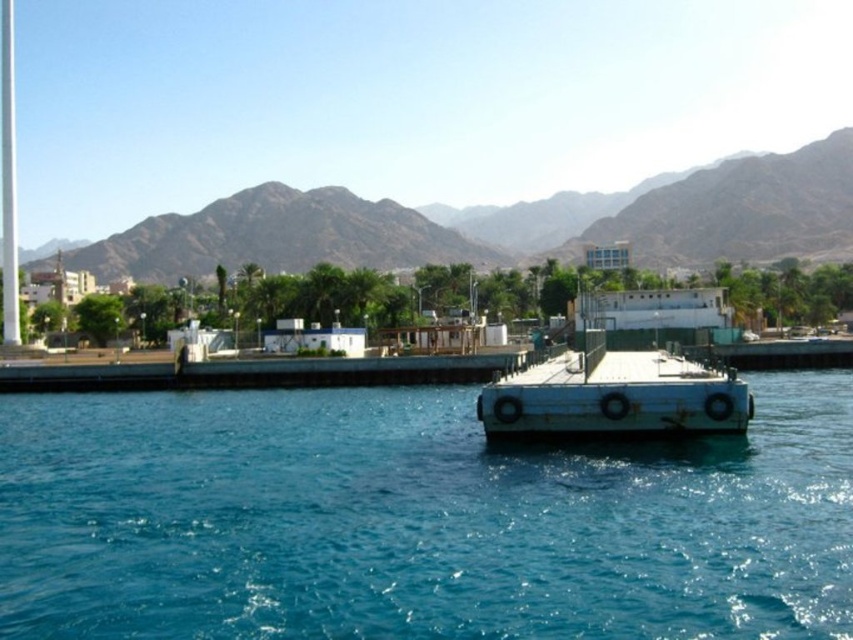
Does brown rocky mountain at upper center have a greater width compared to white matte dock at center?

Indeed, brown rocky mountain at upper center has a greater width compared to white matte dock at center.

Can you confirm if brown rocky mountain at upper center is positioned to the left of white matte dock at center?

Indeed, brown rocky mountain at upper center is positioned on the left side of white matte dock at center.

Is point (229, 253) more distant than point (500, 426)?

Yes, point (229, 253) is behind point (500, 426).

The width and height of the screenshot is (853, 640). I want to click on brown rocky mountain at upper center, so click(280, 237).

Who is lower down, blue glossy water at center or white matte dock at center?

blue glossy water at center is lower down.

Locate an element on the screen. The width and height of the screenshot is (853, 640). blue glossy water at center is located at coordinates (416, 520).

Does point (358, 474) come farther from viewer compared to point (271, 243)?

No.

I want to click on blue glossy water at center, so click(416, 520).

Which is in front, point (210, 444) or point (337, 260)?

Point (210, 444) is in front.

Where is `blue glossy water at center`? blue glossy water at center is located at coordinates pyautogui.click(x=416, y=520).